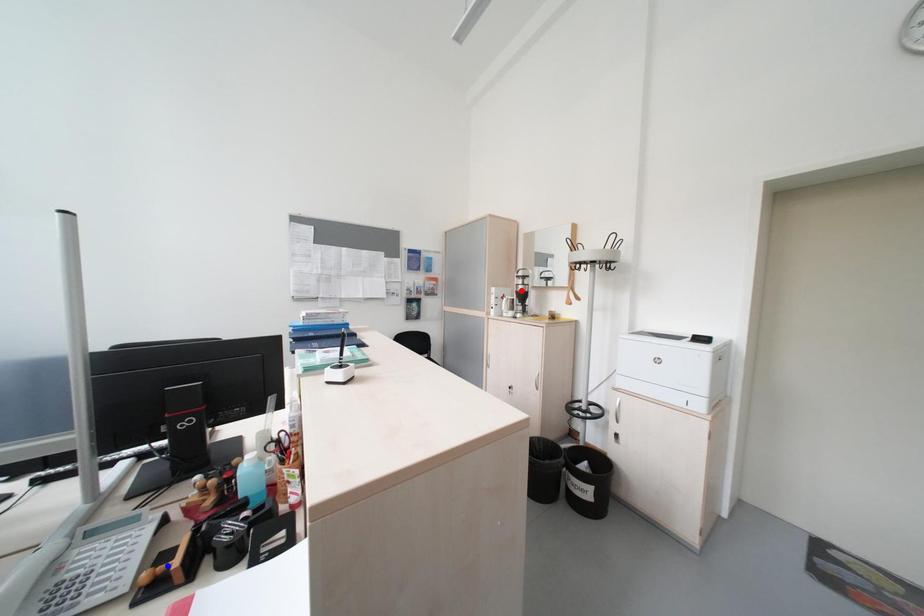
Question: In the image, two points are highlighted. Which point is nearer to the camera? Reply with the corresponding letter.

Choices:
 (A) blue point
 (B) red point

Answer: (A)